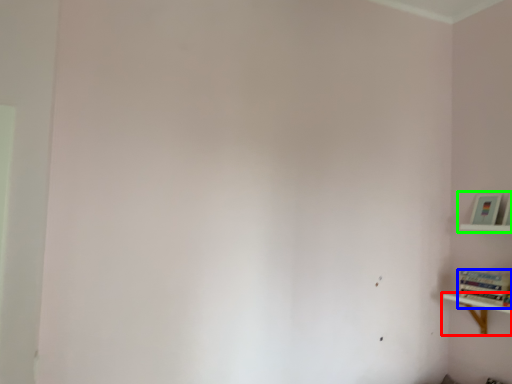
Question: Estimate the real-world distances between objects in this image. Which object is closer to shelf (highlighted by a red box), book (highlighted by a blue box) or shelf (highlighted by a green box)?

Choices:
 (A) book
 (B) shelf

Answer: (A)